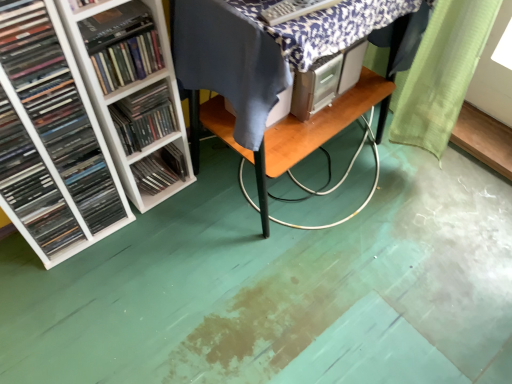
This screenshot has width=512, height=384. I want to click on vacant area that is situated to the right of white plastic shelves at left, which is counted as the second book, starting from the left, so click(x=154, y=244).